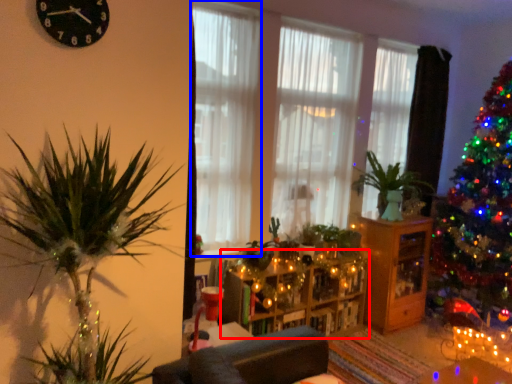
Question: Among these objects, which one is nearest to the camera, entertainment center (highlighted by a red box) or curtain (highlighted by a blue box)?

Choices:
 (A) entertainment center
 (B) curtain

Answer: (B)